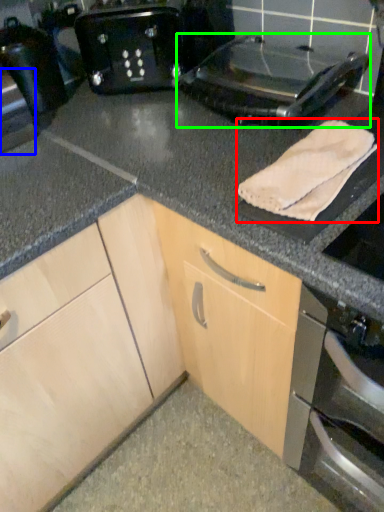
Question: Which object is the closest to the bath towel (highlighted by a red box)? Choose among these: appliance (highlighted by a blue box) or kitchen appliance (highlighted by a green box).

Choices:
 (A) appliance
 (B) kitchen appliance

Answer: (B)